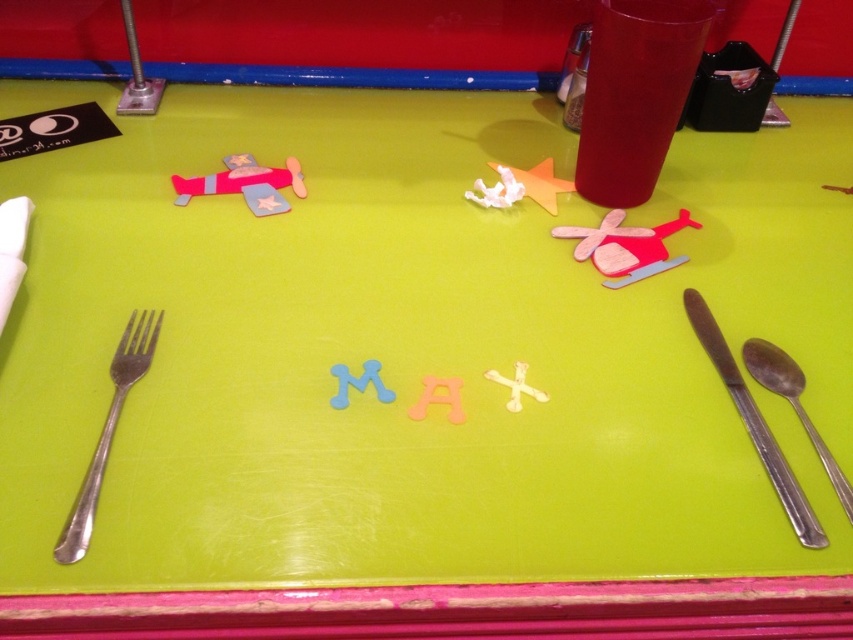
You are a child trying to stack the blue foam letter m at center and the white matte letter x at center. Which one should you place at the bottom to make the stack stable?

The blue foam letter m at center is larger in size than the white matte letter x at center, so placing the blue foam letter m at center at the bottom would provide a more stable base for the stack.

Consider the image. You are setting up a child party and need to place a napkin between the silver metallic fork at left and the silver metallic spoon at lower right. Based on their positions, where should you place the napkin?

The silver metallic fork at left is to the left of the silver metallic spoon at lower right, so you should place the napkin between them, to the right of the silver metallic fork at left and to the left of the silver metallic spoon at lower right.

You are a child trying to pick up a grape using the silver metallic spoon at lower right and the white matte letter x at center. Which object is more suitable for picking up the grape?

The silver metallic spoon at lower right is more suitable for picking up the grape because it has a larger size compared to the white matte letter x at center.